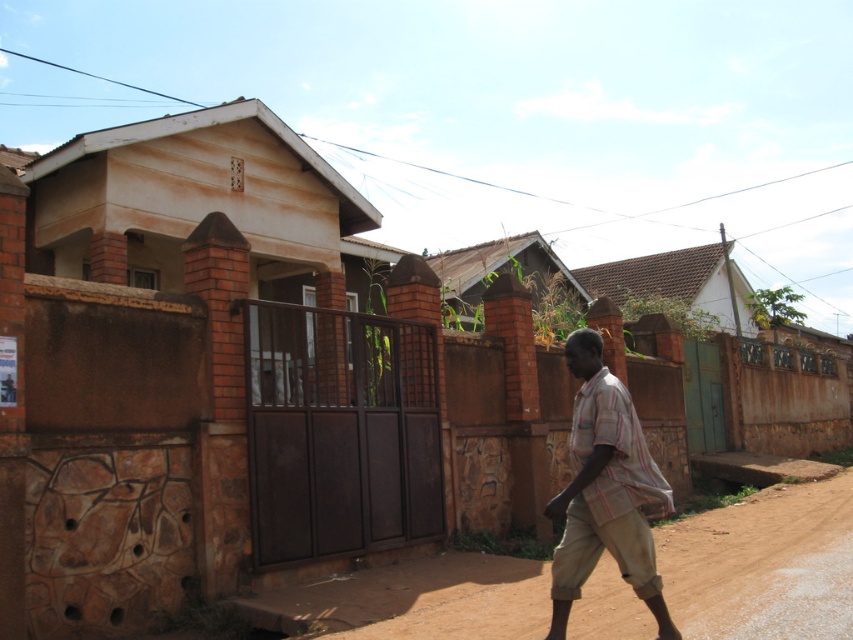
You are a delivery person trying to navigate through the residential area. You have a package that needs to be delivered to the house with the metal gate. The package is too heavy to lift, so you need to roll it along the ground. However, there is a brown dirt track at lower right and a striped cotton shirt at center in your path. Which object is lower to the ground so that the package can pass underneath it without obstruction?

The brown dirt track at lower right has a lesser height compared to the striped cotton shirt at center, so the package can pass under it without obstruction.

You are a delivery driver who needs to turn onto the brown dirt track at lower right. There is a brown metal gate at center blocking the path. Can you drive around the gate to reach the dirt track?

The brown metal gate at center is to the left of brown dirt track at lower right, so you can drive around to the right side of the gate to access the dirt track.